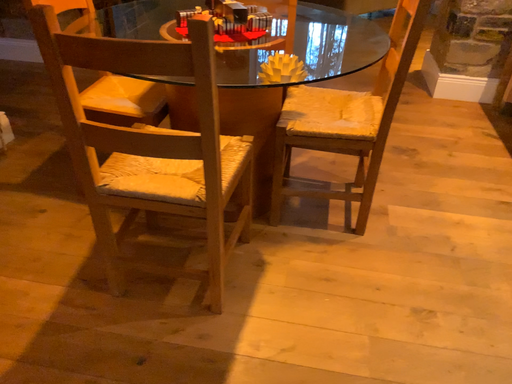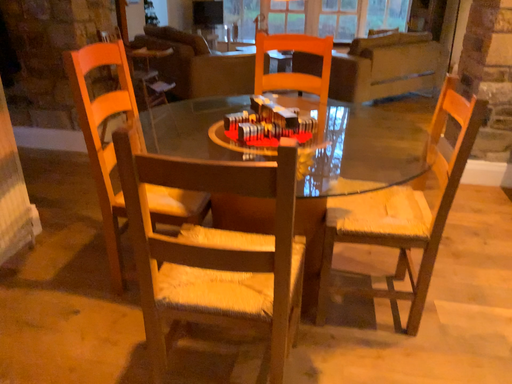
Question: How did the camera likely rotate when shooting the video?

Choices:
 (A) rotated downward
 (B) rotated upward

Answer: (B)